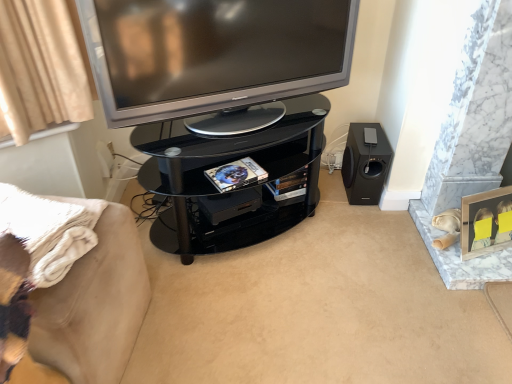
Question: From the image's perspective, is beige fabric couch at lower left beneath black glass tv cabinet at center?

Choices:
 (A) no
 (B) yes

Answer: (B)

Question: Is beige fabric couch at lower left thinner than black glass tv cabinet at center?

Choices:
 (A) yes
 (B) no

Answer: (A)

Question: Does beige fabric couch at lower left lie behind black glass tv cabinet at center?

Choices:
 (A) yes
 (B) no

Answer: (B)

Question: Can you confirm if beige fabric couch at lower left is smaller than black glass tv cabinet at center?

Choices:
 (A) yes
 (B) no

Answer: (A)

Question: From a real-world perspective, is beige fabric couch at lower left positioned under black glass tv cabinet at center based on gravity?

Choices:
 (A) no
 (B) yes

Answer: (B)

Question: Which is correct: silver metallic television at upper center is inside black glass tv cabinet at center, or outside of it?

Choices:
 (A) outside
 (B) inside

Answer: (A)

Question: Is silver metallic television at upper center wider or thinner than black glass tv cabinet at center?

Choices:
 (A) thin
 (B) wide

Answer: (A)

Question: Is silver metallic television at upper center bigger or smaller than black glass tv cabinet at center?

Choices:
 (A) big
 (B) small

Answer: (B)

Question: From the image's perspective, is silver metallic television at upper center located above or below black glass tv cabinet at center?

Choices:
 (A) above
 (B) below

Answer: (A)

Question: Is beige fabric couch at lower left in front of or behind black matte speaker at lower right in the image?

Choices:
 (A) front
 (B) behind

Answer: (A)

Question: From a real-world perspective, relative to black matte speaker at lower right, is beige fabric couch at lower left vertically above or below?

Choices:
 (A) above
 (B) below

Answer: (A)

Question: Is beige fabric couch at lower left inside the boundaries of black matte speaker at lower right, or outside?

Choices:
 (A) outside
 (B) inside

Answer: (A)

Question: From the image's perspective, relative to black matte speaker at lower right, is beige fabric couch at lower left above or below?

Choices:
 (A) above
 (B) below

Answer: (B)

Question: Considering the positions of black glass tv cabinet at center and silver metallic television at upper center in the image, is black glass tv cabinet at center bigger or smaller than silver metallic television at upper center?

Choices:
 (A) small
 (B) big

Answer: (B)

Question: In terms of width, does black glass tv cabinet at center look wider or thinner when compared to silver metallic television at upper center?

Choices:
 (A) wide
 (B) thin

Answer: (A)